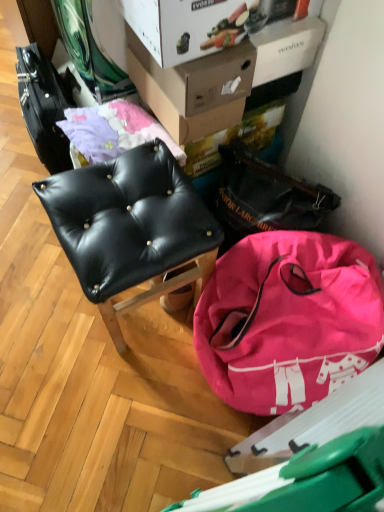
Question: Is white cardboard box at upper center, the second cardboard box when ordered from back to front, shorter than pink fabric bag at lower right?

Choices:
 (A) no
 (B) yes

Answer: (B)

Question: Is pink fabric bag at lower right at the back of white cardboard box at upper center, which is counted as the 1th cardboard box, starting from the front?

Choices:
 (A) yes
 (B) no

Answer: (B)

Question: Does white cardboard box at upper center, which is counted as the 1th cardboard box, starting from the front, come behind pink fabric bag at lower right?

Choices:
 (A) yes
 (B) no

Answer: (A)

Question: From the image's perspective, is white cardboard box at upper center, which is counted as the 1th cardboard box, starting from the front, under pink fabric bag at lower right?

Choices:
 (A) no
 (B) yes

Answer: (A)

Question: Is white cardboard box at upper center, which is counted as the 1th cardboard box, starting from the front, thinner than pink fabric bag at lower right?

Choices:
 (A) no
 (B) yes

Answer: (B)

Question: Is cardboard box at upper center, arranged as the 1th cardboard box when viewed from the back, taller or shorter than pink fabric bag at lower right?

Choices:
 (A) tall
 (B) short

Answer: (B)

Question: Is point click(x=177, y=72) positioned closer to the camera than point click(x=322, y=375)?

Choices:
 (A) farther
 (B) closer

Answer: (A)

Question: From the image's perspective, is cardboard box at upper center, arranged as the 1th cardboard box when viewed from the back, positioned above or below pink fabric bag at lower right?

Choices:
 (A) above
 (B) below

Answer: (A)

Question: Relative to pink fabric bag at lower right, is cardboard box at upper center, which ranks as the 2th cardboard box in front-to-back order, in front or behind?

Choices:
 (A) behind
 (B) front

Answer: (A)

Question: Is point (109, 301) positioned closer to the camera than point (213, 314)?

Choices:
 (A) closer
 (B) farther

Answer: (A)

Question: In terms of size, does black leather chair at center appear bigger or smaller than pink fabric bag at lower right?

Choices:
 (A) big
 (B) small

Answer: (B)

Question: From a real-world perspective, is black leather chair at center positioned above or below pink fabric bag at lower right?

Choices:
 (A) below
 (B) above

Answer: (B)

Question: From the image's perspective, is black leather chair at center above or below pink fabric bag at lower right?

Choices:
 (A) above
 (B) below

Answer: (A)

Question: Is cardboard box at upper center, arranged as the 1th cardboard box when viewed from the back, situated inside white cardboard box at upper center, which is counted as the 1th cardboard box, starting from the front, or outside?

Choices:
 (A) inside
 (B) outside

Answer: (B)

Question: From the image's perspective, is cardboard box at upper center, which ranks as the 2th cardboard box in front-to-back order, located above or below white cardboard box at upper center, which is counted as the 1th cardboard box, starting from the front?

Choices:
 (A) above
 (B) below

Answer: (B)